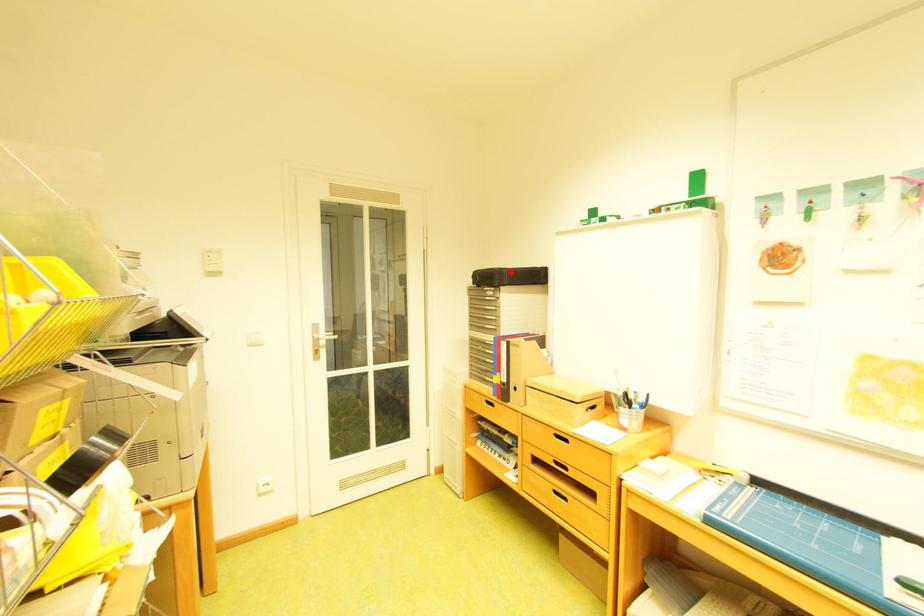
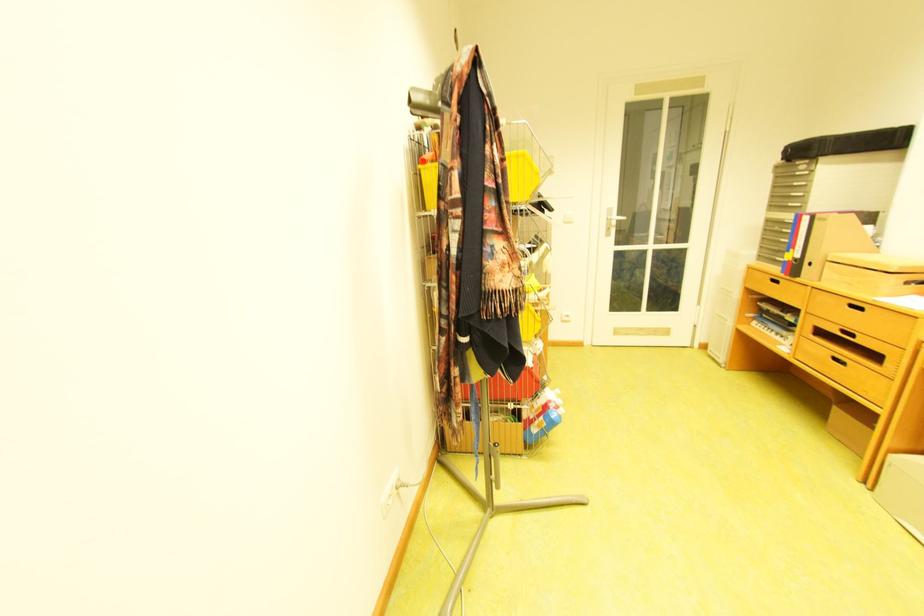
Locate, in the second image, the point that corresponds to the highlighted location in the first image.

(832, 140)